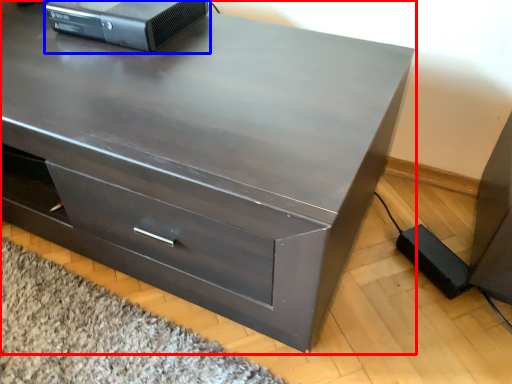
Question: Which of the following is the farthest to the observer, chest of drawers (highlighted by a red box) or desktop computer (highlighted by a blue box)?

Choices:
 (A) chest of drawers
 (B) desktop computer

Answer: (B)